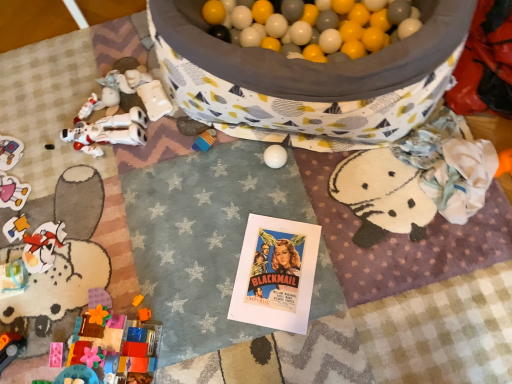
This screenshot has height=384, width=512. What are the coordinates of `free space that is in between white matte robot at left, the fourth toy positioned from the bottom, and orange plastic car at lower left, positioned as the fourth toy in top-to-bottom order` in the screenshot? It's located at (65, 230).